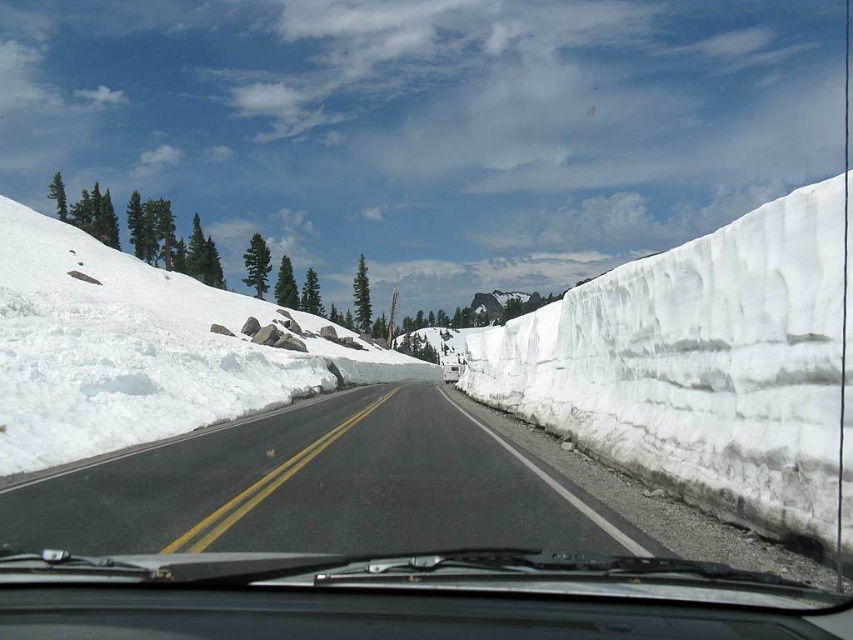
Question: Does black asphalt road at center have a lesser width compared to white fluffy snow at left?

Choices:
 (A) no
 (B) yes

Answer: (B)

Question: Which object is farther from the camera taking this photo?

Choices:
 (A) white fluffy snow at left
 (B) black asphalt road at center

Answer: (A)

Question: Which point appears closest to the camera in this image?

Choices:
 (A) (165, 296)
 (B) (525, 476)

Answer: (B)

Question: Is black asphalt road at center thinner than white fluffy snow at left?

Choices:
 (A) yes
 (B) no

Answer: (A)

Question: Which of the following is the closest to the observer?

Choices:
 (A) black asphalt road at center
 (B) white fluffy snow at left

Answer: (A)

Question: Can you confirm if black asphalt road at center is bigger than white fluffy snow at left?

Choices:
 (A) no
 (B) yes

Answer: (A)